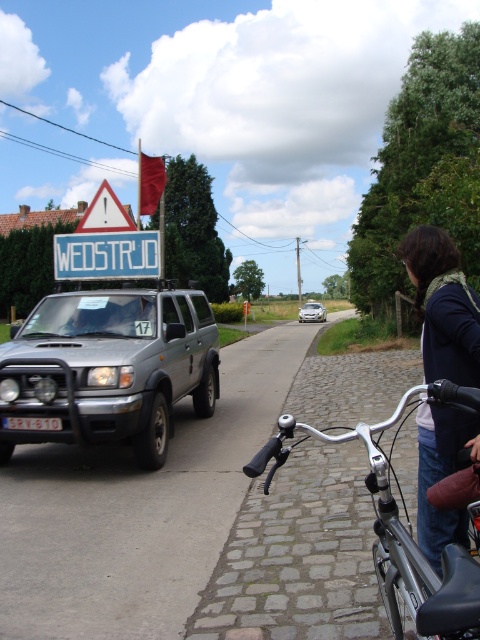
Question: Can you confirm if silver metallic suv at left is thinner than white triangular warning sign at upper left?

Choices:
 (A) yes
 (B) no

Answer: (A)

Question: Does silver metallic bicycle handlebars at lower right appear on the right side of blue metallic license plate at center?

Choices:
 (A) no
 (B) yes

Answer: (B)

Question: Which object is the closest to the silver metallic car at center?

Choices:
 (A) dark blue sweater at right
 (B) blue plastic sign at upper center

Answer: (B)

Question: Is dark blue sweater at right positioned behind white triangular warning sign at upper left?

Choices:
 (A) yes
 (B) no

Answer: (B)

Question: Considering the real-world distances, which object is farthest from the blue plastic sign at upper center?

Choices:
 (A) white triangular warning sign at upper left
 (B) silver metallic car at center
 (C) silver metallic bicycle handlebars at lower right

Answer: (B)

Question: Which of the following is the farthest from the observer?

Choices:
 (A) silver metallic car at center
 (B) blue metallic license plate at center
 (C) blue plastic sign at upper center
 (D) silver metallic bicycle handlebars at lower right

Answer: (A)